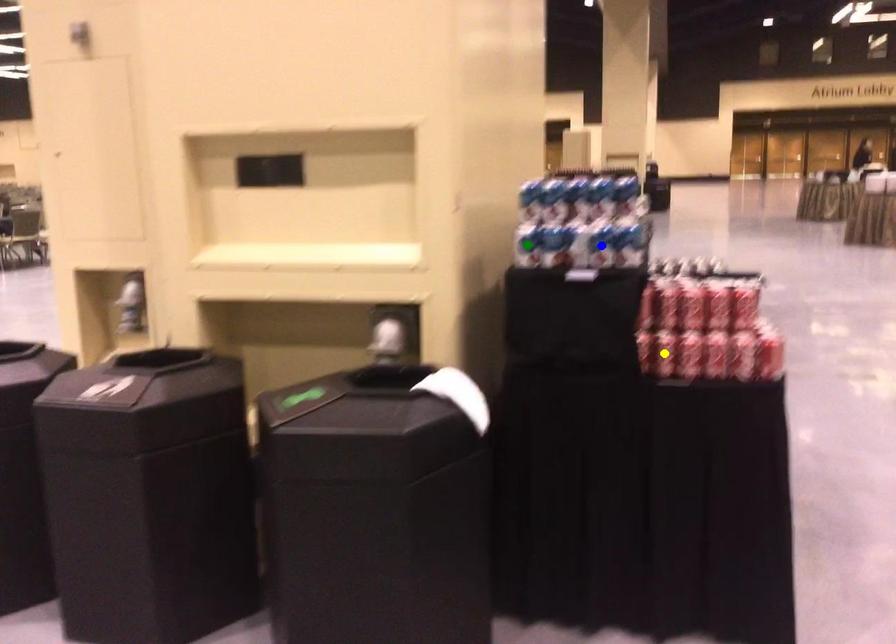
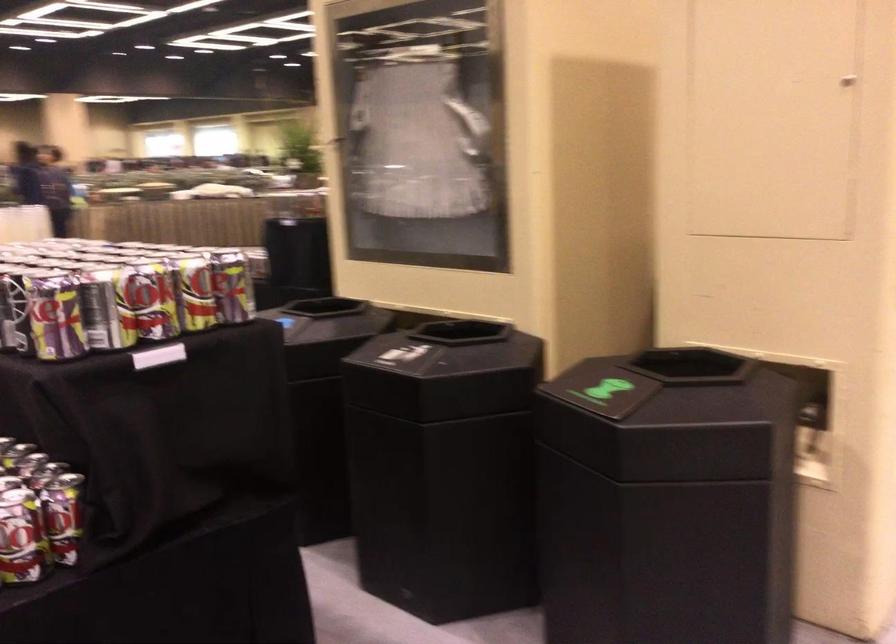
I am providing you with two images of the same scene from different viewpoints. Three points are marked in image1. Which point corresponds to a part or object that is occluded in image2?In image1, three points are marked. Which of them correspond to a part or object that is occluded in image2?Among the three points shown in image1, which one corresponds to a part or object that is no longer visible due to occlusion in image2?

Invisible in image2: green point, blue point, yellow point.